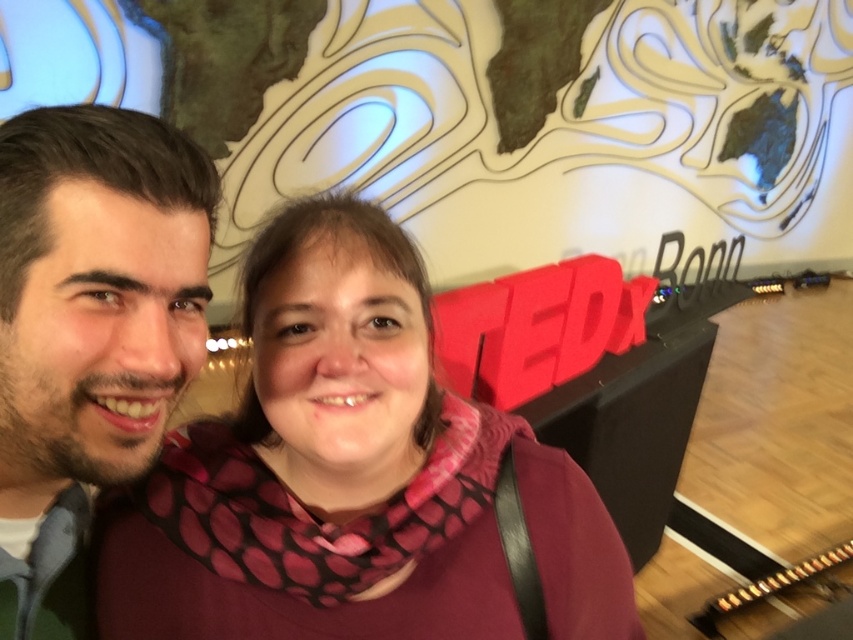
You are a photographer who needs to adjust the lighting for a photo shoot. You notice the pink dotted scarf at center and the dark brown hair at left. Which object requires more light to ensure it stands out, considering their sizes?

The pink dotted scarf at center requires more light because it is bigger than the dark brown hair at left, so it needs adequate illumination to stand out properly.

In the scene shown: You are a photographer at the TEDx Bonn event. You need to ensure that the pink dotted scarf at center and the dark brown hair at left are both visible in the frame. Given that the camera has a fixed width, which object should you prioritize keeping centered to ensure both are captured?

The pink dotted scarf at center should be prioritized as it is wider than the dark brown hair at left, so centering it would allow the narrower dark brown hair at left to fit within the frame more easily.

You are a photographer at the TEDx Bonn event. You notice the pink dotted scarf at center and the dark brown hair at left in the frame. Which object is positioned more to the right in the image?

The pink dotted scarf at center is positioned more to the right than the dark brown hair at left.